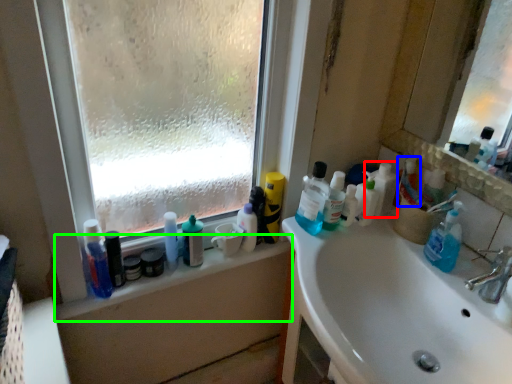
Question: Which is farther away from cleaning product (highlighted by a red box)? toiletry (highlighted by a blue box) or window sill (highlighted by a green box)?

Choices:
 (A) toiletry
 (B) window sill

Answer: (B)